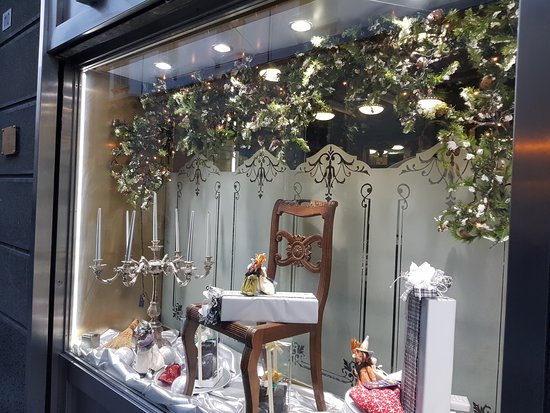
You are a GUI agent. You are given a task and a screenshot of the screen. Output one action in this format:
    pyautogui.click(x=<x>, y=<y>)
    Task: Click on the candelabra
    
    Given the screenshot: What is the action you would take?
    pyautogui.click(x=159, y=262)